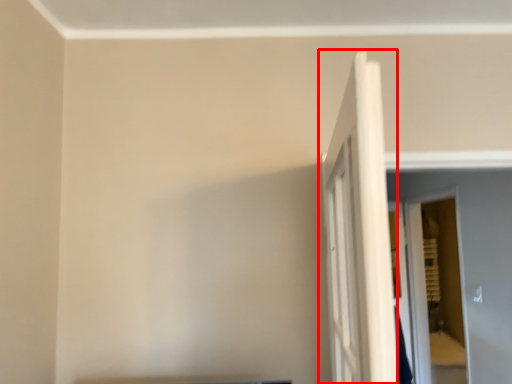
Question: From the image's perspective, where is door (annotated by the red box) located relative to screen door?

Choices:
 (A) above
 (B) below

Answer: (A)